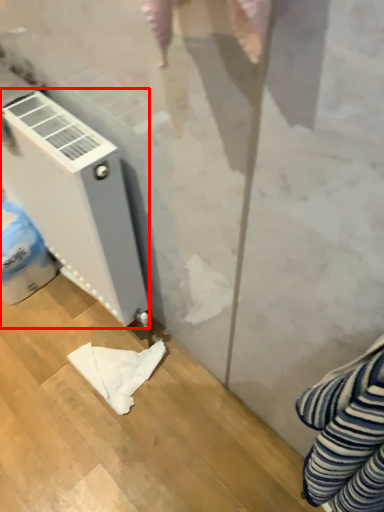
Question: From the image's perspective, what is the correct spatial relationship of home appliance (annotated by the red box) in relation to cloth?

Choices:
 (A) above
 (B) below

Answer: (A)